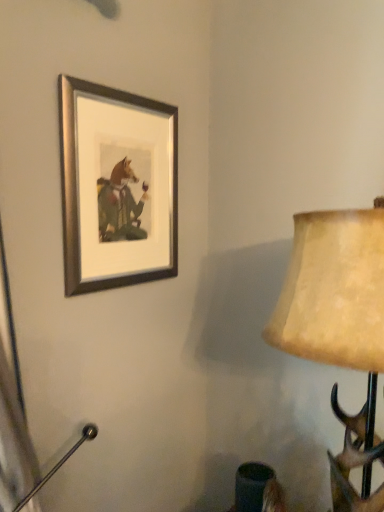
Question: Considering the positions of silver/metallic picture frame at upper left and matte beige lampshade at right in the image, is silver/metallic picture frame at upper left wider or thinner than matte beige lampshade at right?

Choices:
 (A) wide
 (B) thin

Answer: (B)

Question: From the image's perspective, relative to matte beige lampshade at right, is silver/metallic picture frame at upper left above or below?

Choices:
 (A) above
 (B) below

Answer: (A)

Question: Is silver/metallic picture frame at upper left in front of or behind matte beige lampshade at right in the image?

Choices:
 (A) front
 (B) behind

Answer: (B)

Question: Relative to silver/metallic picture frame at upper left, is matte beige lampshade at right in front or behind?

Choices:
 (A) behind
 (B) front

Answer: (B)

Question: Is matte beige lampshade at right wider or thinner than silver/metallic picture frame at upper left?

Choices:
 (A) thin
 (B) wide

Answer: (B)

Question: From a real-world perspective, relative to silver/metallic picture frame at upper left, is matte beige lampshade at right vertically above or below?

Choices:
 (A) above
 (B) below

Answer: (B)

Question: Considering the positions of matte beige lampshade at right and silver/metallic picture frame at upper left in the image, is matte beige lampshade at right taller or shorter than silver/metallic picture frame at upper left?

Choices:
 (A) tall
 (B) short

Answer: (A)